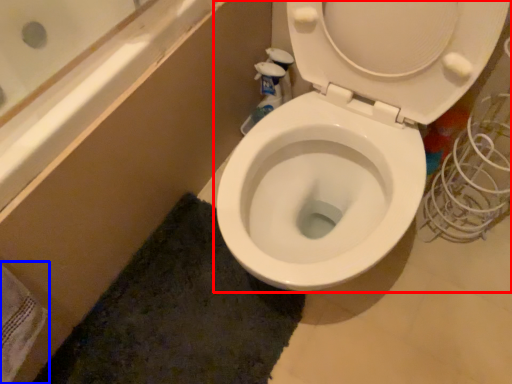
Question: Which object is further to the camera taking this photo, toilet (highlighted by a red box) or bath towel (highlighted by a blue box)?

Choices:
 (A) toilet
 (B) bath towel

Answer: (B)